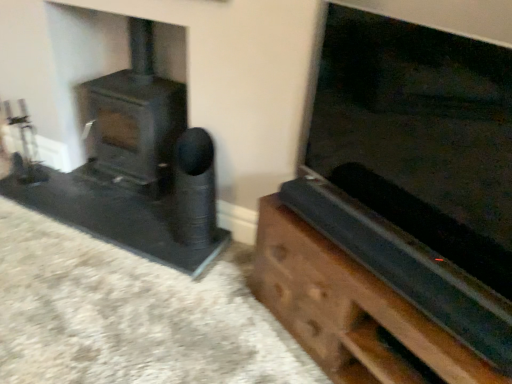
Question: Can you confirm if matte black wood burning stove at left is positioned to the right of black matte speaker at center?

Choices:
 (A) no
 (B) yes

Answer: (A)

Question: Can you confirm if matte black wood burning stove at left is wider than black matte speaker at center?

Choices:
 (A) yes
 (B) no

Answer: (A)

Question: From a real-world perspective, is matte black wood burning stove at left located beneath black matte speaker at center?

Choices:
 (A) yes
 (B) no

Answer: (B)

Question: Is the position of matte black wood burning stove at left less distant than that of black matte speaker at center?

Choices:
 (A) yes
 (B) no

Answer: (B)

Question: Is matte black wood burning stove at left oriented towards black matte speaker at center?

Choices:
 (A) no
 (B) yes

Answer: (A)

Question: Could black matte speaker at center be considered to be inside matte black wood burning stove at left?

Choices:
 (A) yes
 (B) no

Answer: (B)

Question: Does black matte speaker at center appear on the left side of wooden chest at right?

Choices:
 (A) no
 (B) yes

Answer: (B)

Question: From the image's perspective, is black matte speaker at center below wooden chest at right?

Choices:
 (A) no
 (B) yes

Answer: (A)

Question: Is black matte speaker at center turned away from wooden chest at right?

Choices:
 (A) no
 (B) yes

Answer: (A)

Question: Does black matte speaker at center have a greater width compared to wooden chest at right?

Choices:
 (A) yes
 (B) no

Answer: (B)

Question: Can you confirm if black matte speaker at center is bigger than wooden chest at right?

Choices:
 (A) yes
 (B) no

Answer: (B)

Question: From a real-world perspective, is black matte speaker at center below wooden chest at right?

Choices:
 (A) yes
 (B) no

Answer: (B)

Question: Is matte black wood burning stove at left smaller than wooden chest at right?

Choices:
 (A) yes
 (B) no

Answer: (A)